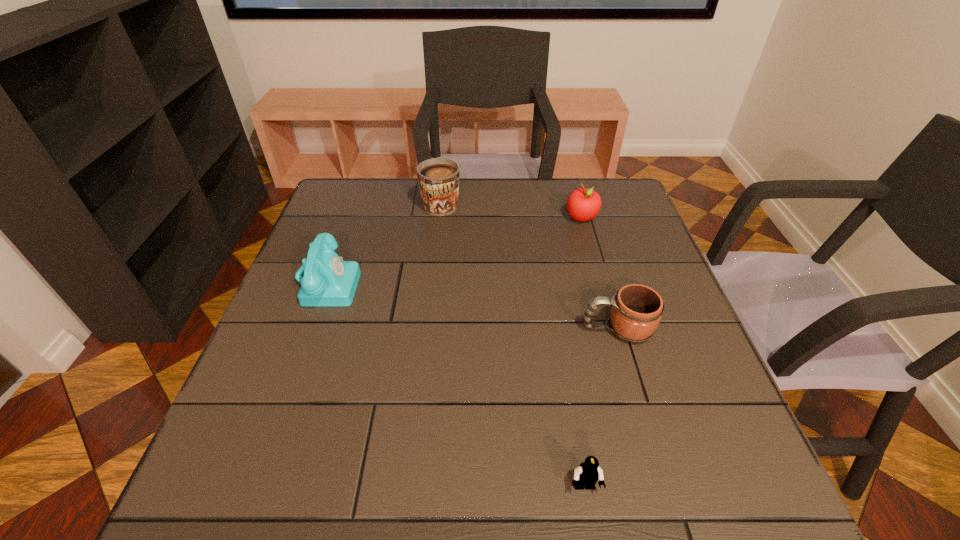
Find the location of a particular element. This screenshot has width=960, height=540. free spot at the far edge of the desktop is located at coordinates (559, 177).

Identify the location of blank area at the near edge. (602, 516).

Identify the location of free space at the left edge of the desktop. (323, 333).

Where is `vacant space at the right edge of the desktop`? vacant space at the right edge of the desktop is located at coordinates (702, 370).

Identify the location of vacant region at the far left corner of the desktop. Image resolution: width=960 pixels, height=540 pixels. (372, 181).

The width and height of the screenshot is (960, 540). Identify the location of vacant space at the far right corner of the desktop. (608, 181).

What are the coordinates of `free region at the near right corner` in the screenshot? It's located at (756, 470).

The width and height of the screenshot is (960, 540). I want to click on vacant point located between the telephone and the Lego, so click(x=456, y=384).

At what (x,y) coordinates should I click in order to perform the action: click on free space between the taller mug and the apple. Please return your answer as a coordinate pair (x, y). Looking at the image, I should click on (512, 210).

The height and width of the screenshot is (540, 960). Identify the location of empty space that is in between the leftmost object and the nearer mug. (472, 306).